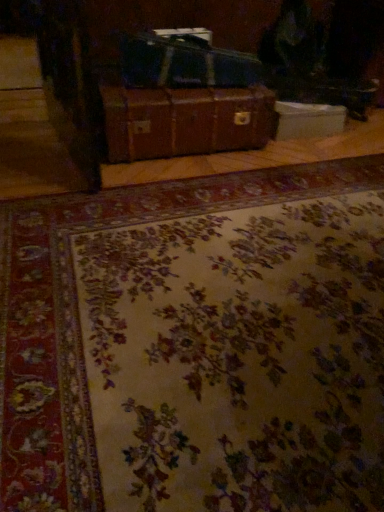
Question: Considering the relative sizes of white cardboard box at center and brown leather suitcase at center in the image provided, is white cardboard box at center shorter than brown leather suitcase at center?

Choices:
 (A) no
 (B) yes

Answer: (B)

Question: Does white cardboard box at center appear on the left side of brown leather suitcase at center?

Choices:
 (A) no
 (B) yes

Answer: (A)

Question: From the image's perspective, does white cardboard box at center appear lower than brown leather suitcase at center?

Choices:
 (A) yes
 (B) no

Answer: (B)

Question: Is white cardboard box at center surrounding brown leather suitcase at center?

Choices:
 (A) yes
 (B) no

Answer: (B)

Question: From the image's perspective, is white cardboard box at center over brown leather suitcase at center?

Choices:
 (A) no
 (B) yes

Answer: (B)

Question: Relative to white cardboard box at center, is shiny black suitcase at center in front or behind?

Choices:
 (A) front
 (B) behind

Answer: (A)

Question: Would you say shiny black suitcase at center is to the left or to the right of white cardboard box at center in the picture?

Choices:
 (A) left
 (B) right

Answer: (A)

Question: In terms of height, does shiny black suitcase at center look taller or shorter compared to white cardboard box at center?

Choices:
 (A) short
 (B) tall

Answer: (B)

Question: Looking at their shapes, would you say shiny black suitcase at center is wider or thinner than white cardboard box at center?

Choices:
 (A) wide
 (B) thin

Answer: (B)

Question: Relative to brown leather suitcase at center, is shiny black suitcase at center in front or behind?

Choices:
 (A) front
 (B) behind

Answer: (B)

Question: In terms of height, does shiny black suitcase at center look taller or shorter compared to brown leather suitcase at center?

Choices:
 (A) short
 (B) tall

Answer: (A)

Question: From a real-world perspective, relative to brown leather suitcase at center, is shiny black suitcase at center vertically above or below?

Choices:
 (A) below
 (B) above

Answer: (B)

Question: Is point (139, 72) positioned closer to the camera than point (163, 138)?

Choices:
 (A) closer
 (B) farther

Answer: (A)

Question: From the image's perspective, is shiny black suitcase at center above or below floral-patterned carpet at center?

Choices:
 (A) above
 (B) below

Answer: (A)

Question: In terms of width, does shiny black suitcase at center look wider or thinner when compared to floral-patterned carpet at center?

Choices:
 (A) wide
 (B) thin

Answer: (B)